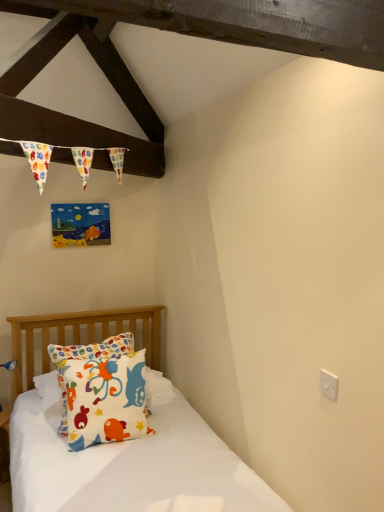
Describe the element at coordinates (101, 391) in the screenshot. Image resolution: width=384 pixels, height=512 pixels. I see `white cotton pillow with colorful fish at center` at that location.

Identify the location of white cotton pillow with colorful fish at center. The width and height of the screenshot is (384, 512). (101, 391).

Where is `white cotton pillow with colorful fish at center`? white cotton pillow with colorful fish at center is located at coordinates (101, 391).